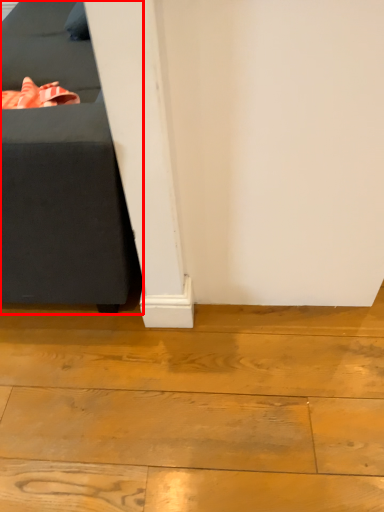
Question: From the image, what is the correct spatial relationship of furniture (annotated by the red box) in relation to wood?

Choices:
 (A) right
 (B) left

Answer: (B)